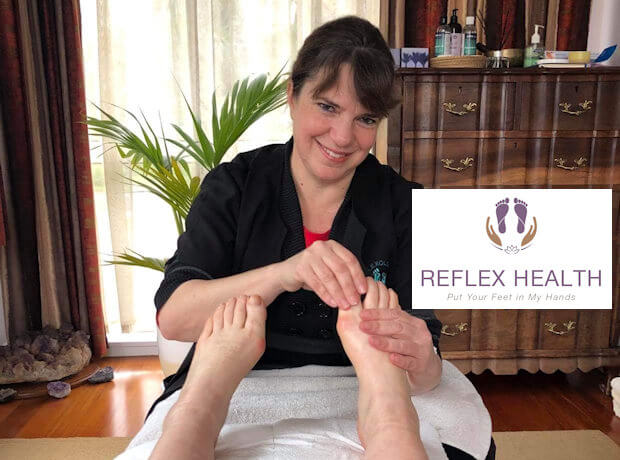
Locate an element on the screen. The height and width of the screenshot is (460, 620). dispenser is located at coordinates (532, 49).